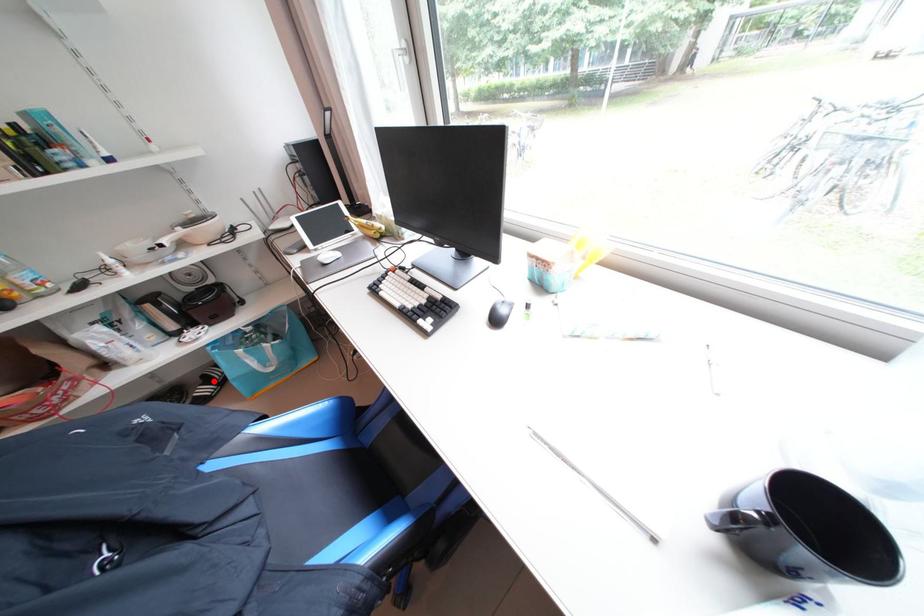
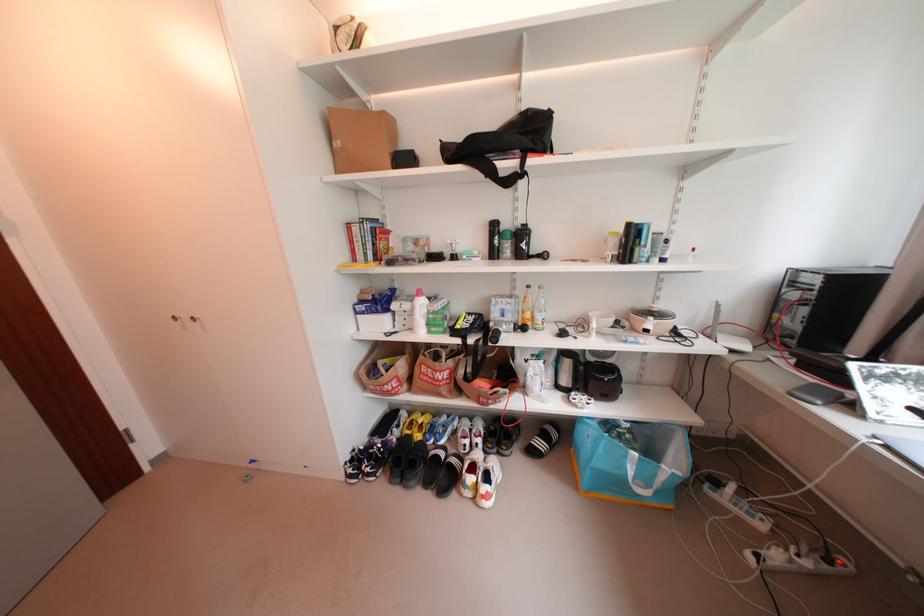
Question: I am providing you with two images of the same scene from different viewpoints. In image1, a red point is highlighted. Considering the same 3D point in image2, which of the following is correct?

Choices:
 (A) It is closer
 (B) It is farther

Answer: (B)